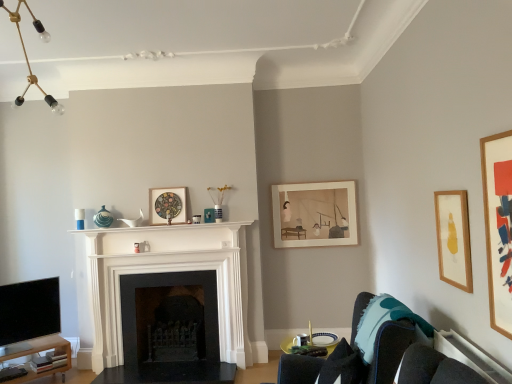
Question: Can you confirm if wooden picture frame at right, the 1th picture frame viewed from the front, is bigger than black matte fireplace at center, positioned as the first fireplace in back-to-front order?

Choices:
 (A) yes
 (B) no

Answer: (B)

Question: Is wooden picture frame at right, placed as the 4th picture frame when sorted from back to front, smaller than black matte fireplace at center, which is the 2th fireplace in front-to-back order?

Choices:
 (A) yes
 (B) no

Answer: (A)

Question: Does wooden picture frame at right, marked as the 3th picture frame in a left-to-right arrangement, appear on the right side of black matte fireplace at center, positioned as the first fireplace in back-to-front order?

Choices:
 (A) yes
 (B) no

Answer: (A)

Question: From the image's perspective, is wooden picture frame at right, marked as the 3th picture frame in a left-to-right arrangement, on top of black matte fireplace at center, which is the 2th fireplace in front-to-back order?

Choices:
 (A) no
 (B) yes

Answer: (B)

Question: Considering the relative sizes of wooden picture frame at right, placed as the 4th picture frame when sorted from back to front, and black matte fireplace at center, positioned as the first fireplace in back-to-front order, in the image provided, is wooden picture frame at right, placed as the 4th picture frame when sorted from back to front, taller than black matte fireplace at center, positioned as the first fireplace in back-to-front order,?

Choices:
 (A) yes
 (B) no

Answer: (A)

Question: Is black matte fireplace at center, which is the 2th fireplace in front-to-back order, wider or thinner than wooden picture frame at right, marked as the 3th picture frame in a left-to-right arrangement?

Choices:
 (A) thin
 (B) wide

Answer: (B)

Question: Considering their positions, is black matte fireplace at center, which is the 2th fireplace in front-to-back order, located in front of or behind wooden picture frame at right, placed as the 4th picture frame when sorted from back to front?

Choices:
 (A) behind
 (B) front

Answer: (A)

Question: Considering the relative positions of black matte fireplace at center, which is the 2th fireplace in front-to-back order, and wooden picture frame at right, placed as the 4th picture frame when sorted from back to front, in the image provided, is black matte fireplace at center, which is the 2th fireplace in front-to-back order, to the left or to the right of wooden picture frame at right, placed as the 4th picture frame when sorted from back to front,?

Choices:
 (A) left
 (B) right

Answer: (A)

Question: Choose the correct answer: Is black matte fireplace at center, positioned as the first fireplace in back-to-front order, inside wooden picture frame at right, marked as the 3th picture frame in a left-to-right arrangement, or outside it?

Choices:
 (A) outside
 (B) inside

Answer: (A)

Question: Considering the relative positions of wooden picture frame at right, placed as the first picture frame when sorted from right to left, and velvet dark blue couch at lower right in the image provided, is wooden picture frame at right, placed as the first picture frame when sorted from right to left, to the left or to the right of velvet dark blue couch at lower right?

Choices:
 (A) right
 (B) left

Answer: (A)

Question: Is wooden picture frame at right, placed as the first picture frame when sorted from right to left, taller or shorter than velvet dark blue couch at lower right?

Choices:
 (A) short
 (B) tall

Answer: (A)

Question: Is point (436, 193) positioned closer to the camera than point (390, 365)?

Choices:
 (A) farther
 (B) closer

Answer: (A)

Question: From the image's perspective, is wooden picture frame at right, acting as the second picture frame starting from the front, positioned above or below velvet dark blue couch at lower right?

Choices:
 (A) below
 (B) above

Answer: (B)

Question: In the image, is white marble fireplace at center, which ranks as the second fireplace in back-to-front order, positioned in front of or behind wooden picture frame at right, placed as the 4th picture frame when sorted from back to front?

Choices:
 (A) behind
 (B) front

Answer: (A)

Question: In terms of height, does white marble fireplace at center, which ranks as the second fireplace in back-to-front order, look taller or shorter compared to wooden picture frame at right, which is counted as the second picture frame, starting from the right?

Choices:
 (A) tall
 (B) short

Answer: (A)